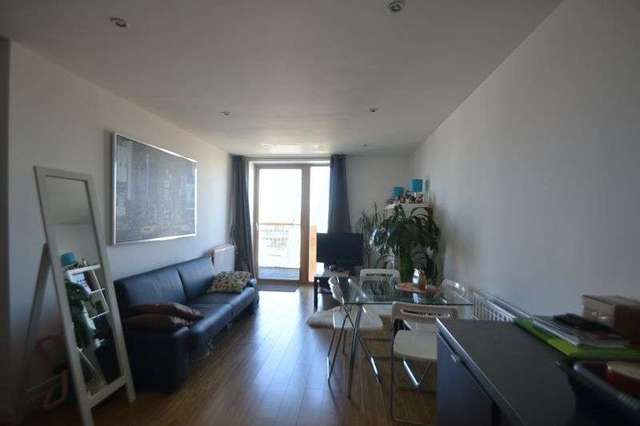
The height and width of the screenshot is (426, 640). What are the coordinates of `light shinning in window` in the screenshot? It's located at (280, 202).